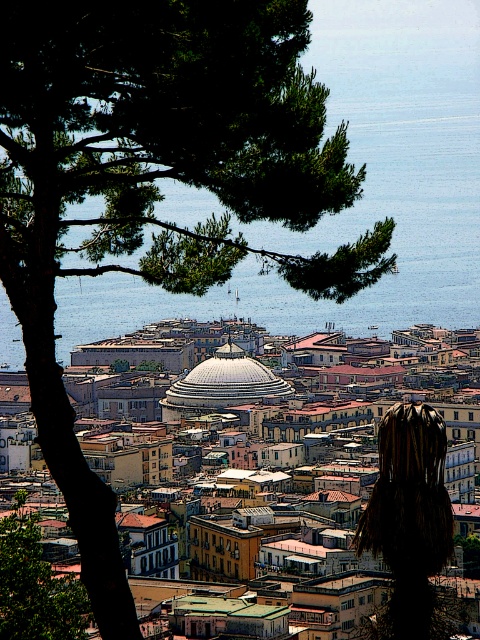
You are standing in the city square and want to take a photo of the white glossy dome at center without the green leafy tree at upper left blocking the view. Which direction should you move to ensure the tree is out of frame?

Move to the right side of the white glossy dome at center so that the green leafy tree at upper left is no longer in the frame, as the tree is positioned to the left of the dome.

You are an architect analyzing the urban layout of this coastal city. You observe the white dome at center and the white glossy dome at center. Which dome is closer to your viewpoint?

The white dome at center is closer to your viewpoint as it is positioned in front of the white glossy dome at center.